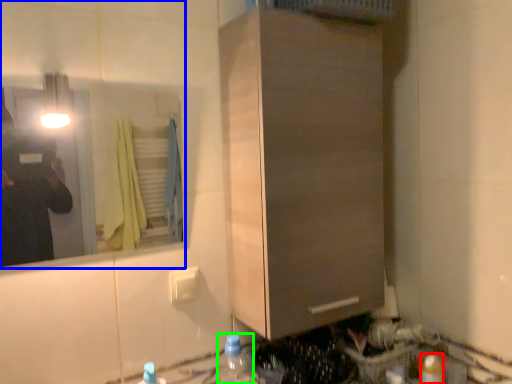
Question: Considering the real-world distances, which object is closest to bottle (highlighted by a red box)? mirror (highlighted by a blue box) or bottle (highlighted by a green box).

Choices:
 (A) mirror
 (B) bottle

Answer: (B)